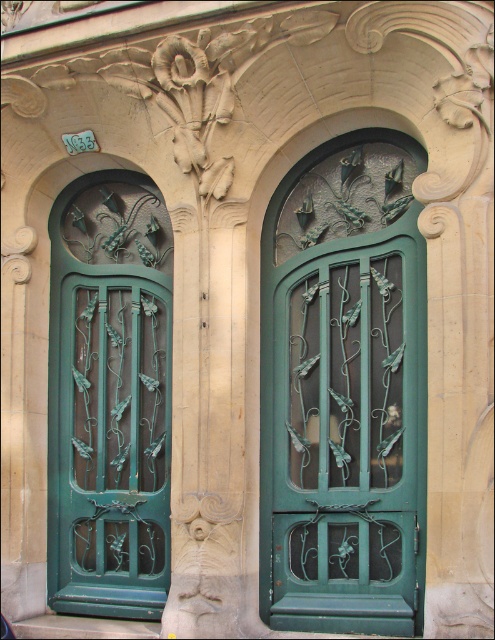
You are an architect designing a new building and want to replicate the door design seen in the image. You need to know the relative sizes of the doors to ensure proper scaling. Which door has a greater width between the green wrought iron door at center and the green wrought iron door at left?

The green wrought iron door at center has a greater width than the green wrought iron door at left.

You are standing in front of the green wrought iron doors. There are two points marked on the doors. One is at coordinate point (378, 618) and the other is at point (159, 572). Which point is closer to you?

Point (378, 618) is closer to the viewer than point (159, 572).